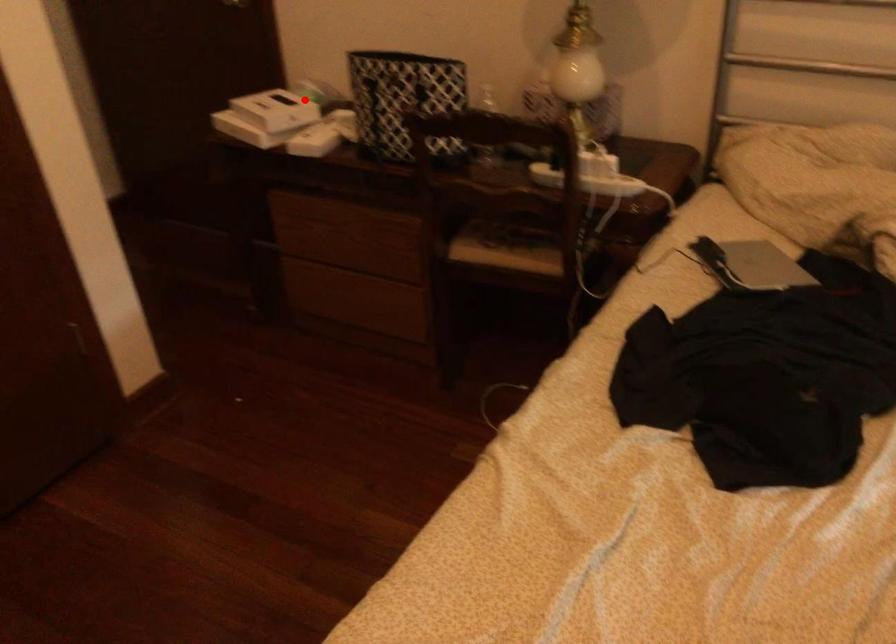
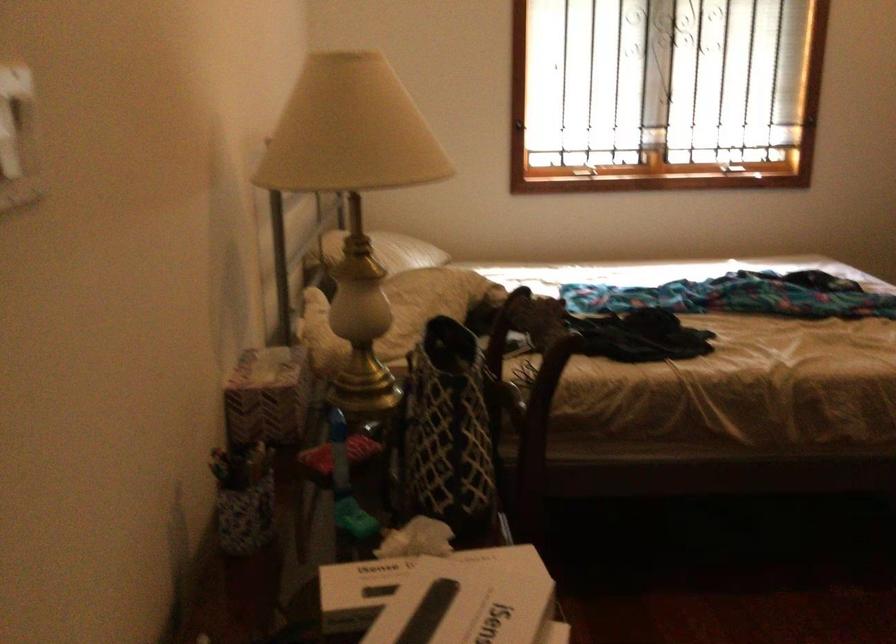
Question: A red point is marked in image1. In image2, is the corresponding 3D point closer to the camera or farther? Reply with the corresponding letter.

Choices:
 (A) The corresponding 3D point is closer.
 (B) The corresponding 3D point is farther.

Answer: (A)